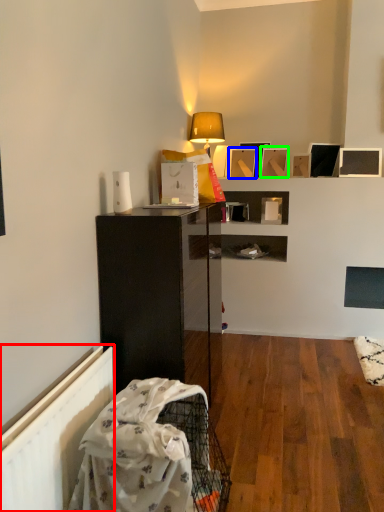
Question: Estimate the real-world distances between objects in this image. Which object is closer to radiator (highlighted by a red box), picture frame (highlighted by a blue box) or picture frame (highlighted by a green box)?

Choices:
 (A) picture frame
 (B) picture frame

Answer: (A)